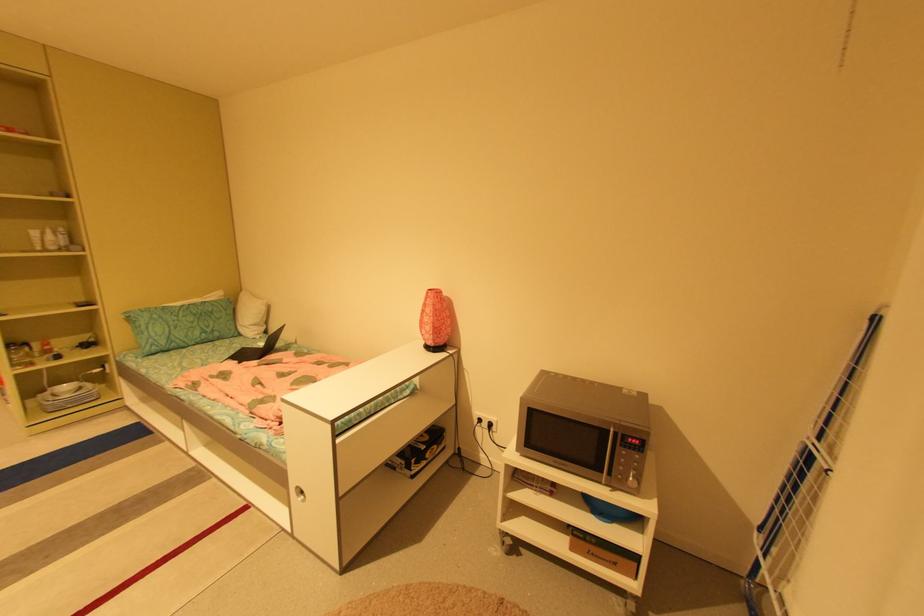
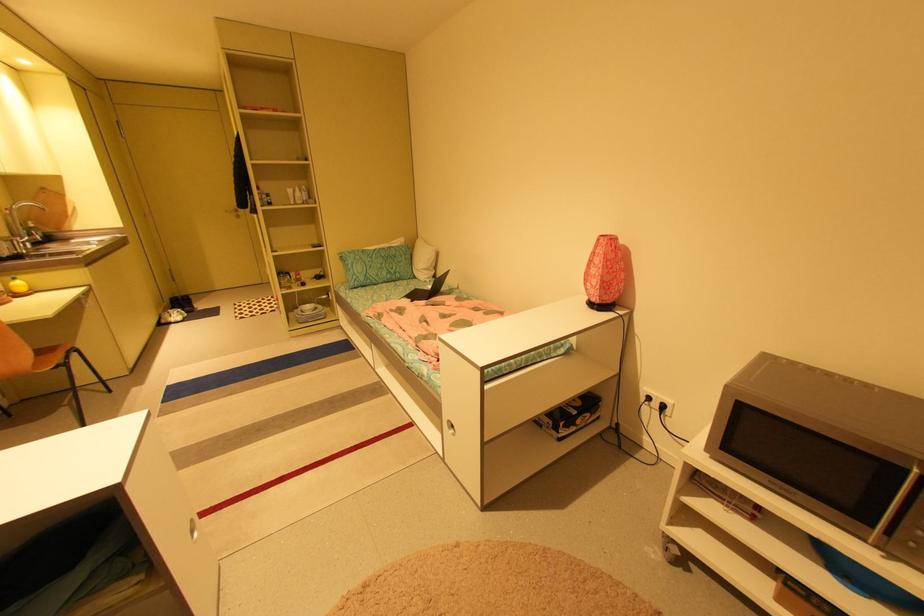
Where in the second image is the point corresponding to pixel 610 474 from the first image?

(879, 528)